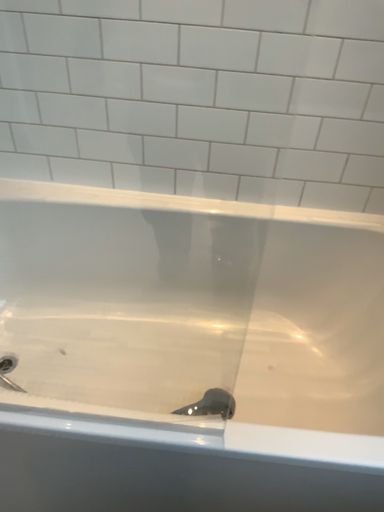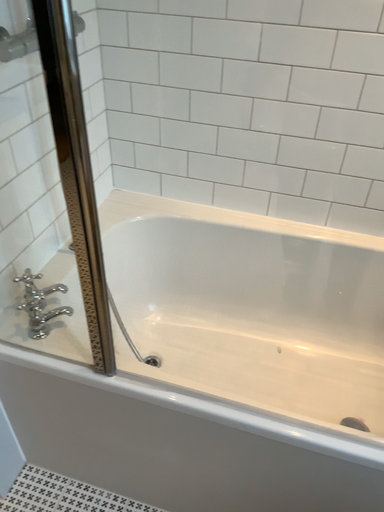
Question: Which way did the camera rotate in the video?

Choices:
 (A) rotated left
 (B) rotated right

Answer: (A)